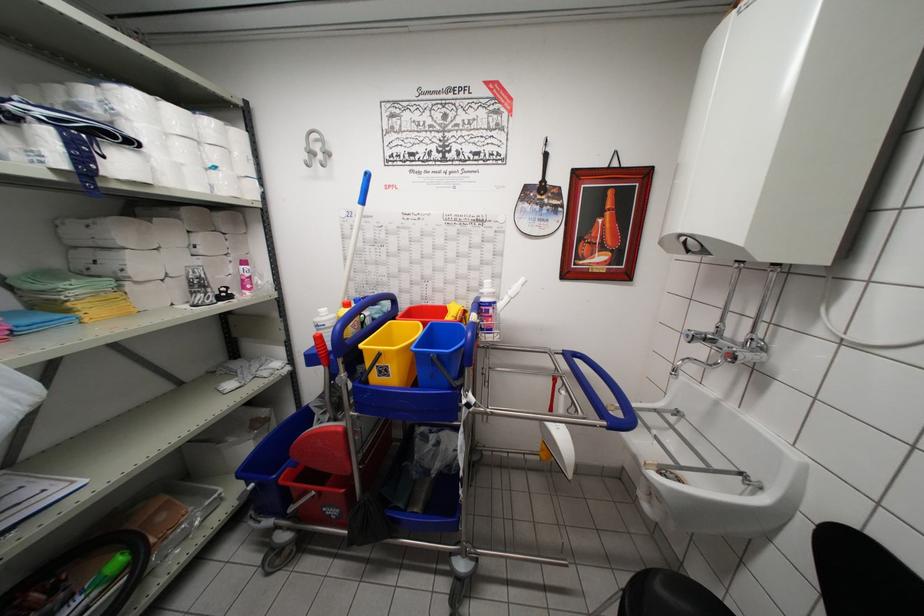
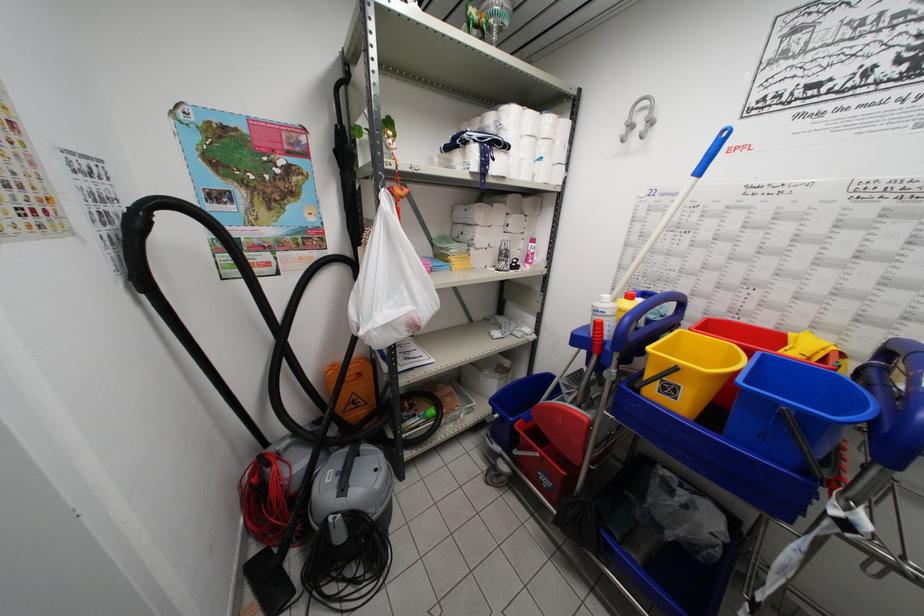
Question: The first image is from the beginning of the video and the second image is from the end. How did the camera likely rotate when shooting the video?

Choices:
 (A) Left
 (B) Right
 (C) Up
 (D) Down

Answer: (A)